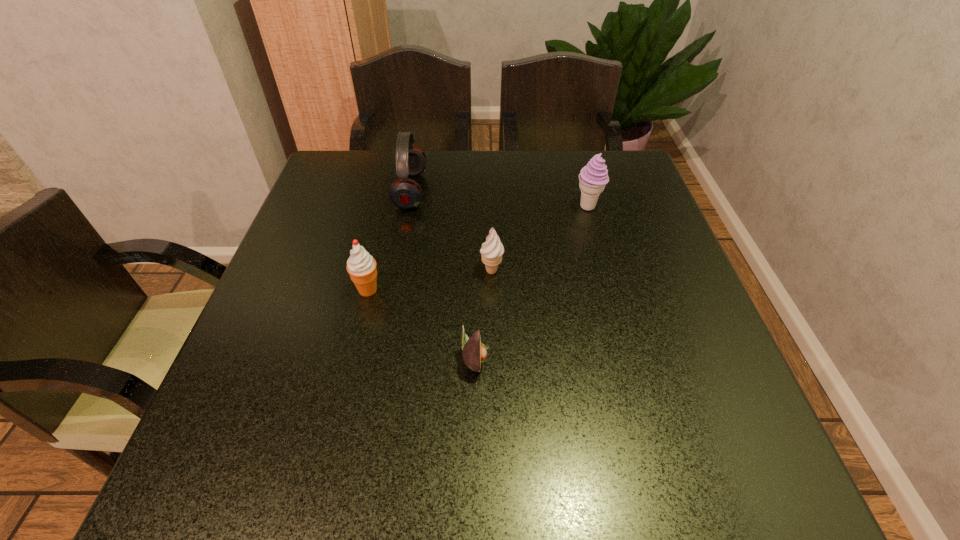
Locate an element on the screen. unoccupied area between the shortest object and the farthest icecream is located at coordinates (532, 282).

I want to click on unoccupied area between the earphone and the second nearest object, so click(390, 240).

This screenshot has width=960, height=540. I want to click on free spot between the third nearest object and the shortest object, so click(484, 314).

Locate an element on the screen. This screenshot has height=540, width=960. free space between the second farthest icecream and the rightmost icecream is located at coordinates (540, 239).

The height and width of the screenshot is (540, 960). I want to click on the second closest object to the second icecream from right to left, so click(x=361, y=266).

This screenshot has width=960, height=540. Identify the location of object that is the second closest to the farthest icecream. (405, 193).

Select which icecream appears as the closest to the rightmost icecream. Please provide its 2D coordinates. Your answer should be formatted as a tuple, i.e. [(x, y)], where the tuple contains the x and y coordinates of a point satisfying the conditions above.

[(492, 250)]

Identify which icecream is located as the third nearest to the earphone. Please provide its 2D coordinates. Your answer should be formatted as a tuple, i.e. [(x, y)], where the tuple contains the x and y coordinates of a point satisfying the conditions above.

[(593, 177)]

Locate an element on the screen. Image resolution: width=960 pixels, height=540 pixels. free space that satisfies the following two spatial constraints: 1. on the ear cups of the earphone; 2. on the left side of the rightmost object is located at coordinates pyautogui.click(x=408, y=207).